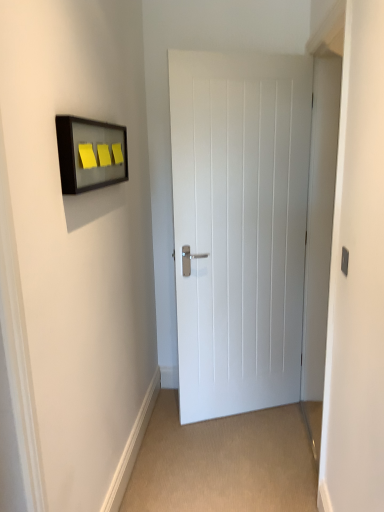
Question: Is matte gray switch at right oriented towards matte glass frame at upper left?

Choices:
 (A) yes
 (B) no

Answer: (A)

Question: Is matte gray switch at right taller than matte glass frame at upper left?

Choices:
 (A) yes
 (B) no

Answer: (B)

Question: Does matte gray switch at right contain matte glass frame at upper left?

Choices:
 (A) no
 (B) yes

Answer: (A)

Question: From the image's perspective, is matte gray switch at right located beneath matte glass frame at upper left?

Choices:
 (A) yes
 (B) no

Answer: (A)

Question: Does matte gray switch at right touch matte glass frame at upper left?

Choices:
 (A) yes
 (B) no

Answer: (B)

Question: Considering the relative positions of matte gray switch at right and matte glass frame at upper left in the image provided, is matte gray switch at right behind matte glass frame at upper left?

Choices:
 (A) yes
 (B) no

Answer: (A)

Question: Does white painted wood door at center have a smaller size compared to matte glass frame at upper left?

Choices:
 (A) no
 (B) yes

Answer: (A)

Question: Does white painted wood door at center contain matte glass frame at upper left?

Choices:
 (A) no
 (B) yes

Answer: (A)

Question: Is the depth of white painted wood door at center less than that of matte glass frame at upper left?

Choices:
 (A) yes
 (B) no

Answer: (B)

Question: Does white painted wood door at center appear on the left side of matte glass frame at upper left?

Choices:
 (A) no
 (B) yes

Answer: (A)

Question: Is white painted wood door at center bigger than matte glass frame at upper left?

Choices:
 (A) yes
 (B) no

Answer: (A)

Question: Can we say white painted wood door at center lies outside matte glass frame at upper left?

Choices:
 (A) yes
 (B) no

Answer: (A)

Question: Considering the relative sizes of matte glass frame at upper left and white painted wood door at center in the image provided, is matte glass frame at upper left thinner than white painted wood door at center?

Choices:
 (A) no
 (B) yes

Answer: (B)